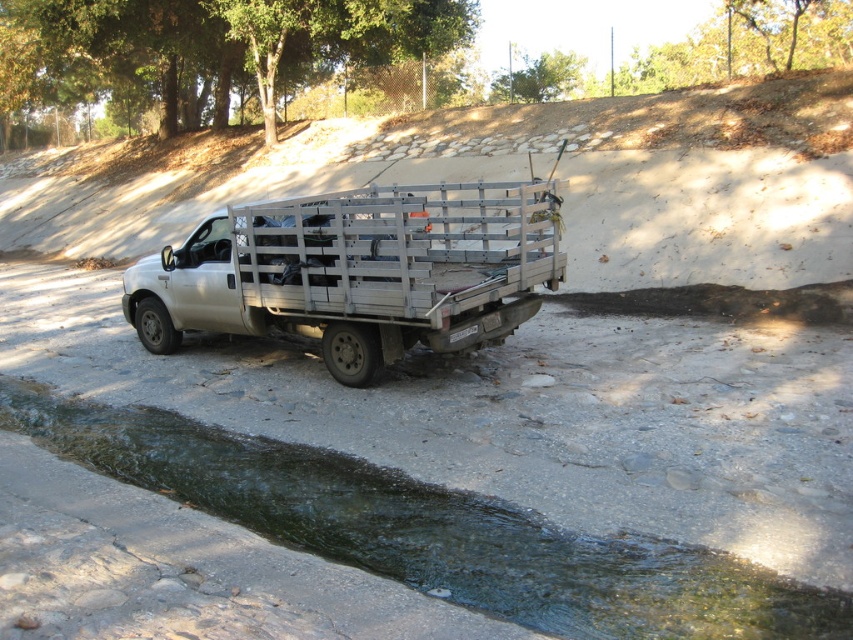
Is clear water at bottom left taller than white metallic truck at center?

In fact, clear water at bottom left may be shorter than white metallic truck at center.

Is point (694, 560) closer to camera compared to point (242, 218)?

That is True.

Is point (4, 403) positioned in front of point (479, 273)?

Yes, point (4, 403) is closer to viewer.

The width and height of the screenshot is (853, 640). What are the coordinates of `clear water at bottom left` in the screenshot? It's located at (430, 531).